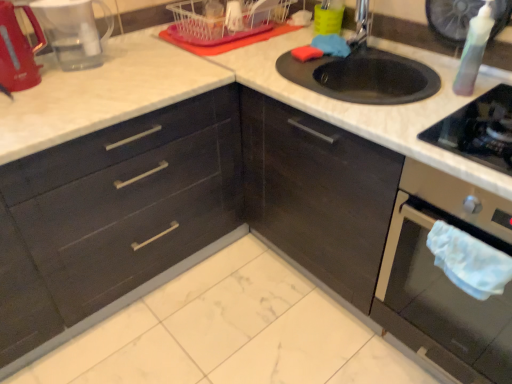
The width and height of the screenshot is (512, 384). What do you see at coordinates (474, 50) in the screenshot?
I see `transparent plastic bottle at upper right` at bounding box center [474, 50].

What do you see at coordinates (361, 25) in the screenshot?
I see `metallic silver faucet at upper right` at bounding box center [361, 25].

I want to click on metallic silver faucet at upper right, so tap(361, 25).

What do you see at coordinates (114, 219) in the screenshot?
I see `matte black drawers at left` at bounding box center [114, 219].

The height and width of the screenshot is (384, 512). I want to click on matte black oven at lower right, so click(x=444, y=279).

What do you see at coordinates (444, 279) in the screenshot? I see `matte black oven at lower right` at bounding box center [444, 279].

The width and height of the screenshot is (512, 384). Find the location of `transparent plastic bottle at upper right`. transparent plastic bottle at upper right is located at coordinates (474, 50).

Does point (428, 6) lie in front of point (274, 5)?

Yes.

Which of these two, transparent plastic bottle at upper right, the second appliance in the left-to-right sequence, or white plastic basket at upper center, stands shorter?

white plastic basket at upper center is shorter.

How different are the orientations of transparent plastic bottle at upper right and red plastic coffee maker at upper left in degrees?

151 degrees.

From the image's perspective, does transparent plastic bottle at upper right appear higher than red plastic coffee maker at upper left?

No, from the image's perspective, transparent plastic bottle at upper right is not on top of red plastic coffee maker at upper left.

Considering the sizes of transparent plastic bottle at upper right and red plastic coffee maker at upper left in the image, is transparent plastic bottle at upper right wider or thinner than red plastic coffee maker at upper left?

transparent plastic bottle at upper right is thinner than red plastic coffee maker at upper left.

Based on the photo, is transparent plastic bottle at upper right outside of red plastic coffee maker at upper left?

Yes, transparent plastic bottle at upper right is located beyond the bounds of red plastic coffee maker at upper left.

From the image's perspective, which is below, metallic red kettle at left, which is the second appliance from right to left, or matte black oven at lower right?

From the image's view, matte black oven at lower right is below.

Would you say matte black oven at lower right is part of metallic red kettle at left, which is the second appliance from right to left,'s contents?

That's incorrect, matte black oven at lower right is not inside metallic red kettle at left, which is the second appliance from right to left.

Based on the photo, are metallic red kettle at left, which is the second appliance from right to left, and matte black oven at lower right beside each other?

No, metallic red kettle at left, which is the second appliance from right to left, is not with matte black oven at lower right.

What's the angular difference between transparent plastic bottle at upper right and metallic red kettle at left, the 1th appliance from the left,'s facing directions?

The angular difference between transparent plastic bottle at upper right and metallic red kettle at left, the 1th appliance from the left, is 2.35 degrees.

Is point (467, 36) closer or farther from the camera than point (11, 79)?

Clearly, point (467, 36) is more distant from the camera than point (11, 79).

Does transparent plastic bottle at upper right have a larger size compared to metallic red kettle at left, which is the second appliance from right to left?

No, transparent plastic bottle at upper right is not bigger than metallic red kettle at left, which is the second appliance from right to left.

From the image's perspective, between transparent plastic bottle at upper right and metallic red kettle at left, which is the second appliance from right to left, who is located below?

transparent plastic bottle at upper right appears lower in the image.

Which of these two, white plastic basket at upper center or black glass gas stove at right, is bigger?

white plastic basket at upper center.

Is white plastic basket at upper center inside the boundaries of black glass gas stove at right, or outside?

white plastic basket at upper center exists outside the volume of black glass gas stove at right.

Could you tell me if white plastic basket at upper center is facing black glass gas stove at right?

No, white plastic basket at upper center is not oriented towards black glass gas stove at right.

From a real-world perspective, is white plastic basket at upper center physically above black glass gas stove at right?

Correct, in the physical world, white plastic basket at upper center is higher than black glass gas stove at right.

What are the coordinates of `cabinetry located underneath the red plastic coffee maker at upper left (from a real-world perspective)` in the screenshot? It's located at (114, 219).

In the scene shown: Is matte black drawers at left spatially inside red plastic coffee maker at upper left, or outside of it?

matte black drawers at left is not enclosed by red plastic coffee maker at upper left.

Is matte black drawers at left in contact with red plastic coffee maker at upper left?

No, matte black drawers at left is not beside red plastic coffee maker at upper left.

The image size is (512, 384). In the image, there is a transparent plastic bottle at upper right. Find the location of `cabinetry below it (from a real-world perspective)`. cabinetry below it (from a real-world perspective) is located at coordinates (114, 219).

From a real-world perspective, who is located higher, transparent plastic bottle at upper right or matte black drawers at left?

transparent plastic bottle at upper right is physically above.

From the image's perspective, which one is positioned higher, transparent plastic bottle at upper right or matte black drawers at left?

transparent plastic bottle at upper right is shown above in the image.

Considering the relative sizes of transparent plastic bottle at upper right and matte black drawers at left in the image provided, is transparent plastic bottle at upper right thinner than matte black drawers at left?

Indeed, transparent plastic bottle at upper right has a lesser width compared to matte black drawers at left.

You are a GUI agent. You are given a task and a screenshot of the screen. Output one action in this format:
    pyautogui.click(x=<x>, y=<y>)
    Task: Click on the appliance on the right of white plastic basket at upper center
    The image size is (512, 384).
    Given the screenshot: What is the action you would take?
    pyautogui.click(x=451, y=18)

Where is `coffee machine directly beneath the transparent plastic bottle at upper right (from a real-world perspective)`? This screenshot has height=384, width=512. coffee machine directly beneath the transparent plastic bottle at upper right (from a real-world perspective) is located at coordinates (73, 31).

From the image, which object appears to be farther from metallic silver faucet at upper right, transparent plastic bottle at upper right or black glass gas stove at right?

black glass gas stove at right lies further to metallic silver faucet at upper right than the other object.

When comparing their distances from transparent plastic bottle at upper right, acting as the first appliance starting from the right, does white plastic basket at upper center or matte black oven at lower right seem closer?

Based on the image, matte black oven at lower right appears to be nearer to transparent plastic bottle at upper right, acting as the first appliance starting from the right.

Which object lies further to the anchor point metallic red kettle at left, which is the second appliance from right to left, black glass gas stove at right or transparent plastic bottle at upper right?

Based on the image, transparent plastic bottle at upper right appears to be further to metallic red kettle at left, which is the second appliance from right to left.

Based on their spatial positions, is matte black oven at lower right or transparent plastic bottle at upper right, acting as the first appliance starting from the right, closer to matte black drawers at left?

Based on the image, matte black oven at lower right appears to be nearer to matte black drawers at left.

From the image, which object appears to be nearer to matte black drawers at left, transparent plastic bottle at upper right, acting as the first appliance starting from the right, or black glass gas stove at right?

Among the two, black glass gas stove at right is located nearer to matte black drawers at left.

Considering their positions, is metallic red kettle at left, which is the second appliance from right to left, positioned further to matte black oven at lower right than transparent plastic bottle at upper right?

metallic red kettle at left, which is the second appliance from right to left, is further to matte black oven at lower right.

From the picture: Which object lies nearer to the anchor point transparent plastic bottle at upper right, transparent plastic bottle at upper right, the second appliance in the left-to-right sequence, or metallic silver faucet at upper right?

The object closer to transparent plastic bottle at upper right is transparent plastic bottle at upper right, the second appliance in the left-to-right sequence.

Considering their positions, is transparent plastic bottle at upper right positioned further to metallic silver faucet at upper right than matte black drawers at left?

matte black drawers at left is further to metallic silver faucet at upper right.

The image size is (512, 384). Find the location of `coffee machine situated between metallic red kettle at left, the 1th appliance from the left, and metallic silver faucet at upper right from left to right`. coffee machine situated between metallic red kettle at left, the 1th appliance from the left, and metallic silver faucet at upper right from left to right is located at coordinates (73, 31).

This screenshot has width=512, height=384. In order to click on faucet between metallic red kettle at left, which is the second appliance from right to left, and matte black oven at lower right in this screenshot , I will do `click(361, 25)`.

This screenshot has height=384, width=512. I want to click on coffee machine between matte black drawers at left and matte black oven at lower right from left to right, so click(73, 31).

Where is `coffee machine between metallic red kettle at left, the 1th appliance from the left, and transparent plastic bottle at upper right, acting as the first appliance starting from the right`? coffee machine between metallic red kettle at left, the 1th appliance from the left, and transparent plastic bottle at upper right, acting as the first appliance starting from the right is located at coordinates (73, 31).